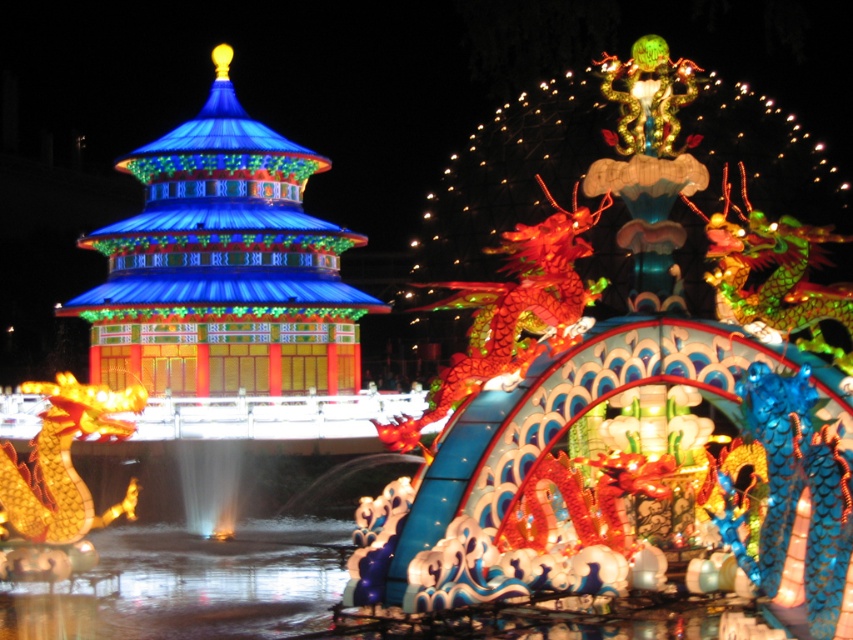
Does shiny blue pagoda at center have a lesser width compared to clear liquid water at center?

In fact, shiny blue pagoda at center might be wider than clear liquid water at center.

Is shiny blue pagoda at center below clear liquid water at center?

No, shiny blue pagoda at center is not below clear liquid water at center.

Is point (283, 168) positioned behind point (112, 532)?

Yes, point (283, 168) is behind point (112, 532).

Where is `shiny blue pagoda at center`? shiny blue pagoda at center is located at coordinates (223, 266).